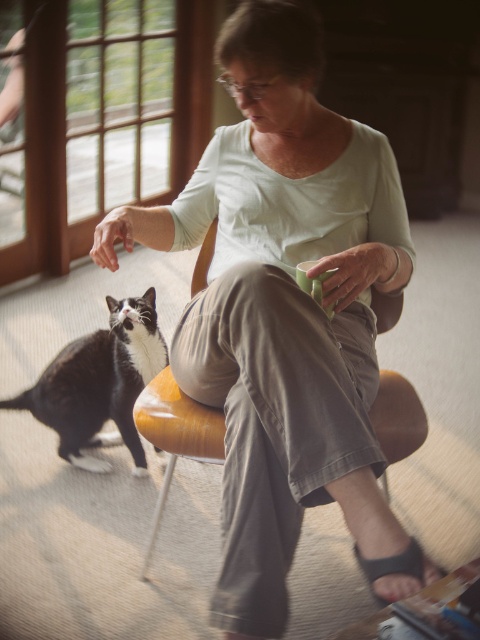
You are an interior designer assessing the proportions of items in the room. Given that the wooden chair at center is standard size, does the matte green shirt at center seem too large or too small for an average adult?

The matte green shirt at center has a width larger than the wooden chair at center, which is standard size. This suggests the matte green shirt at center is too large for an average adult.

You are a delivery robot that is 0.5 meters wide. You need to deliver a package to the woman sitting on the wooden chair. There is a black and white fur cat at lower left in the way. Can you navigate around the cat without getting too close to it? The minimum safe distance between the robot and the cat should be at least 1 meter.

The distance between the woman and the cat is 1.94 meters. Since the robot is 0.5 meters wide, it can navigate around the cat while maintaining a safe distance of at least 1 meter. Subtracting the robot width from the total distance, there is enough space to maneuver safely.

You are a photographer trying to capture the woman and the cat in the scene. Since you want to focus on the matte green shirt at center and the black and white fur cat at lower left, which object should you adjust your camera focus on first to ensure both are in clear view?

The matte green shirt at center is closer to the viewer than the black and white fur cat at lower left, so you should focus on the matte green shirt at center first to ensure proper depth of field for both subjects.